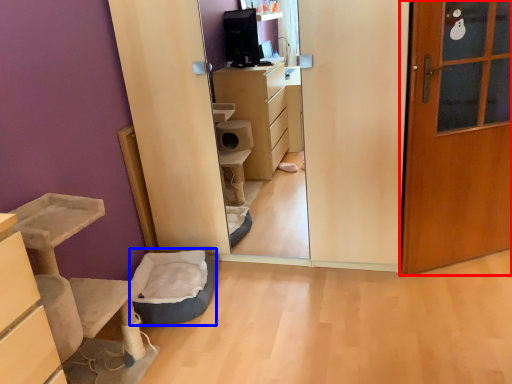
Question: Which of the following is the closest to the observer, door (highlighted by a red box) or infant bed (highlighted by a blue box)?

Choices:
 (A) door
 (B) infant bed

Answer: (A)